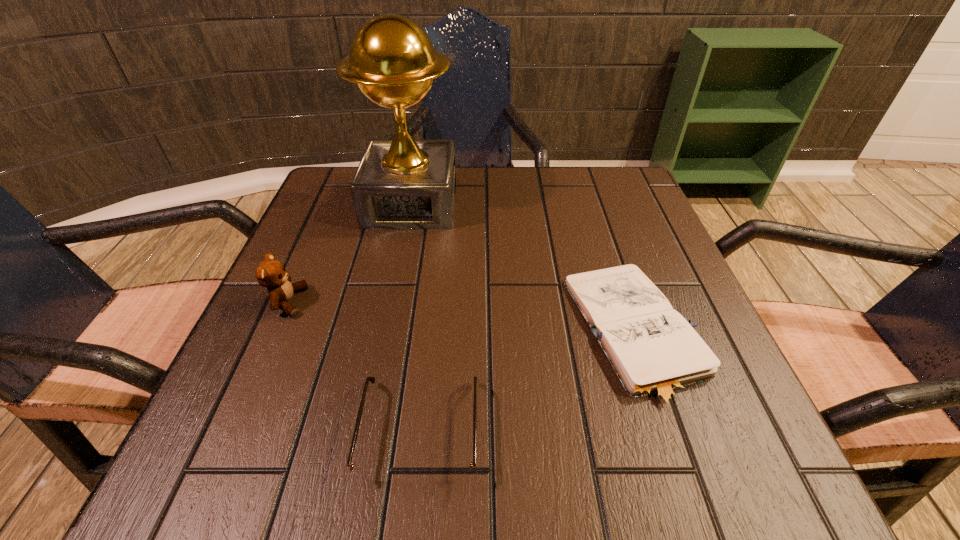
I want to click on vacant area that lies between the spectacles and the rightmost object, so click(x=529, y=382).

Identify which object is the closest to the notebook. Please provide its 2D coordinates. Your answer should be formatted as a tuple, i.e. [(x, y)], where the tuple contains the x and y coordinates of a point satisfying the conditions above.

[(371, 474)]

Where is `the third closest object relative to the spectacles`? The height and width of the screenshot is (540, 960). the third closest object relative to the spectacles is located at coordinates point(403,183).

Find the location of a particular element. This screenshot has width=960, height=540. vacant region that satisfies the following two spatial constraints: 1. on the front-facing side of the rightmost object; 2. on the left side of the leftmost object is located at coordinates (275, 333).

At what (x,y) coordinates should I click in order to perform the action: click on free location that satisfies the following two spatial constraints: 1. on the front-facing side of the rightmost object; 2. on the right side of the tallest object. Please return your answer as a coordinate pair (x, y). The width and height of the screenshot is (960, 540). Looking at the image, I should click on (385, 333).

Where is `free location that satisfies the following two spatial constraints: 1. on the front-facing side of the tallest object; 2. on the right side of the rightmost object`? Image resolution: width=960 pixels, height=540 pixels. free location that satisfies the following two spatial constraints: 1. on the front-facing side of the tallest object; 2. on the right side of the rightmost object is located at coordinates (385, 333).

Identify the location of free region that satisfies the following two spatial constraints: 1. on the front-facing side of the leftmost object; 2. on the back side of the shortest object. The height and width of the screenshot is (540, 960). (275, 333).